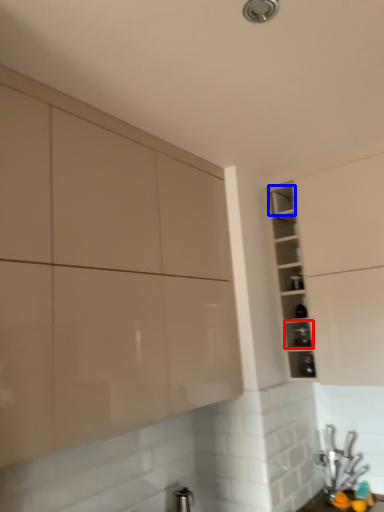
Question: Among these objects, which one is nearest to the camera, shelf (highlighted by a red box) or shelf (highlighted by a blue box)?

Choices:
 (A) shelf
 (B) shelf

Answer: (A)